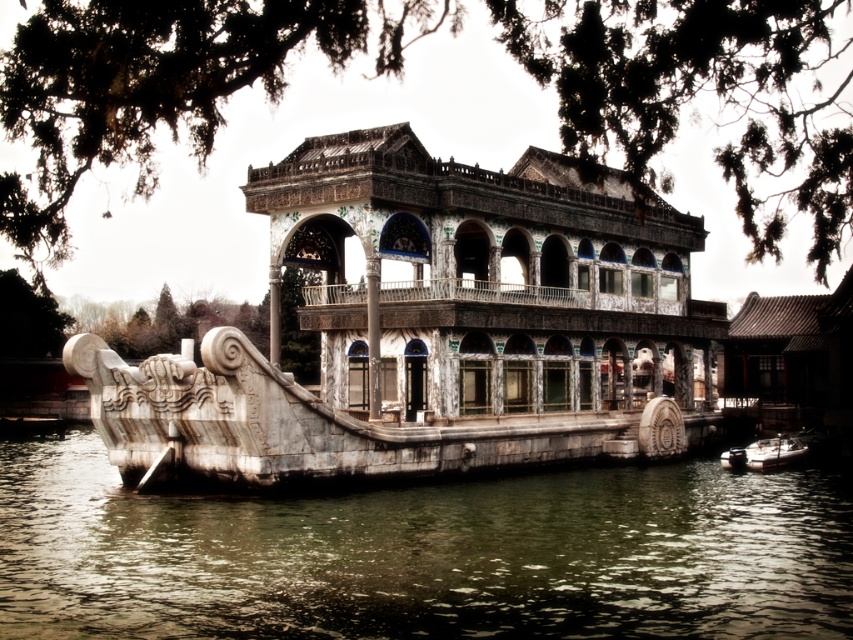
You are standing at the center of the pavilion and looking towards the dragon motif. There are two points marked on the ground in front of you. The first point is at coordinates point (x=645, y=582) and the second point is at point (x=761, y=460). Which point is closer to you?

Point (x=645, y=582) is in front of point (x=761, y=460), so the first point is closer to you.

You are a visitor standing at the edge of the pond near the pavilion. You see the greenish water at lower center and the metallic silver boat at lower right. Which object takes up more space in the image?

The greenish water at lower center takes up more space in the image as it has a larger size compared to the metallic silver boat at lower right.

You are standing on the deck of the pavilion and looking down at the water. Which object, the greenish water at lower center or the metallic silver boat at lower right, is higher from your viewpoint?

The greenish water at lower center is taller than the metallic silver boat at lower right, so from your viewpoint on the pavilion deck, the greenish water at lower center appears higher.